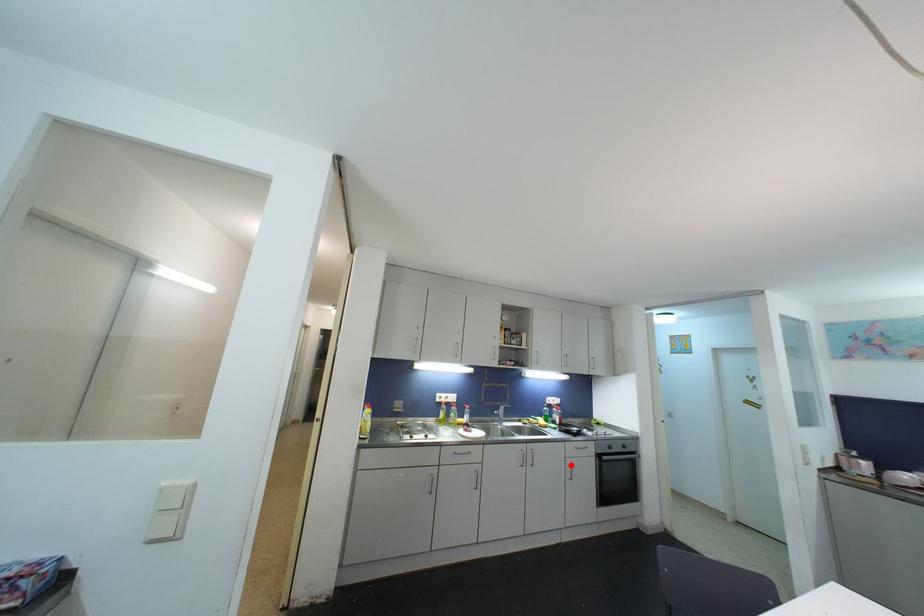
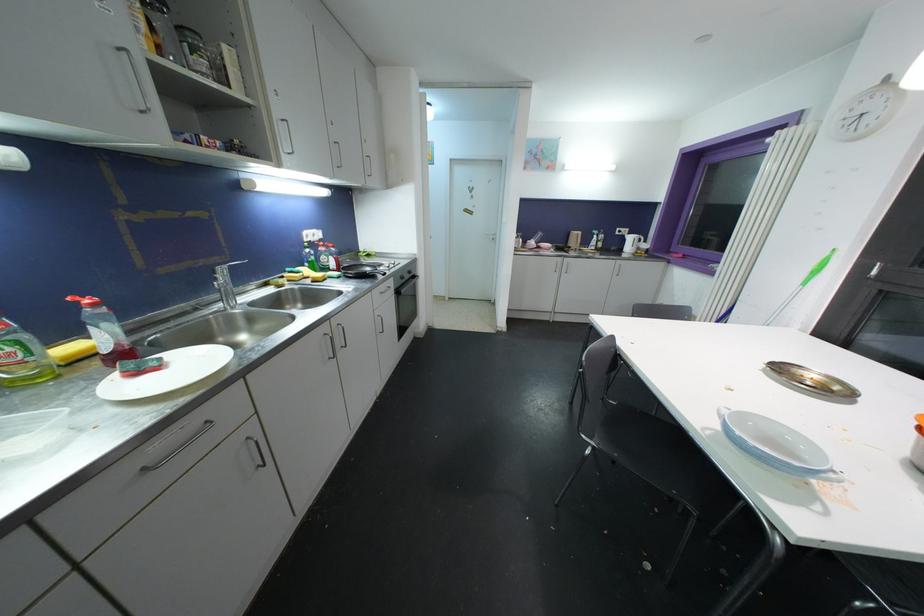
Question: I am providing you with two images of the same scene from different viewpoints. Image1 has a red point marked. In image2, the corresponding 3D location appears at what relative position? Reply with the corresponding letter.

Choices:
 (A) Closer
 (B) Farther

Answer: (A)